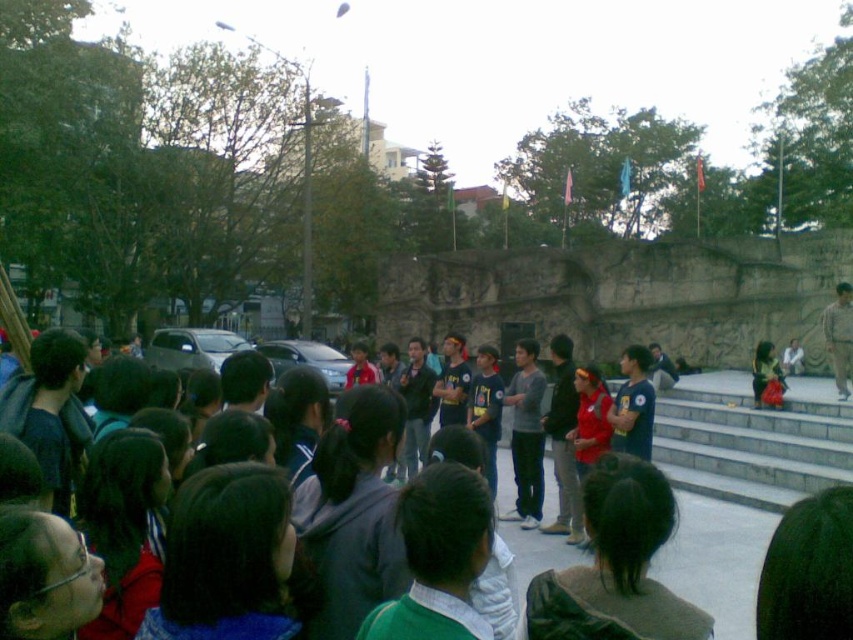
Who is higher up, gray concrete stairs at center or blue denim jacket at center?

Positioned higher is blue denim jacket at center.

Between point (775, 444) and point (791, 364), which one is positioned behind?

Positioned behind is point (791, 364).

In order to click on gray concrete stairs at center in this screenshot , I will do `click(751, 445)`.

Is point (689, 404) positioned in front of point (773, 358)?

No.

Who is more forward, [761,548] or [758,346]?

Positioned in front is point [761,548].

Between point (801, 429) and point (772, 376), which one is positioned in front?

Positioned in front is point (801, 429).

Image resolution: width=853 pixels, height=640 pixels. Find the location of `dark blue shirt at center`. dark blue shirt at center is located at coordinates (740, 481).

Does light brown fabric shirt at center have a greater width compared to blue denim jacket at center?

Yes, light brown fabric shirt at center is wider than blue denim jacket at center.

The height and width of the screenshot is (640, 853). What do you see at coordinates (839, 337) in the screenshot?
I see `light brown fabric shirt at center` at bounding box center [839, 337].

The height and width of the screenshot is (640, 853). I want to click on light brown fabric shirt at center, so click(839, 337).